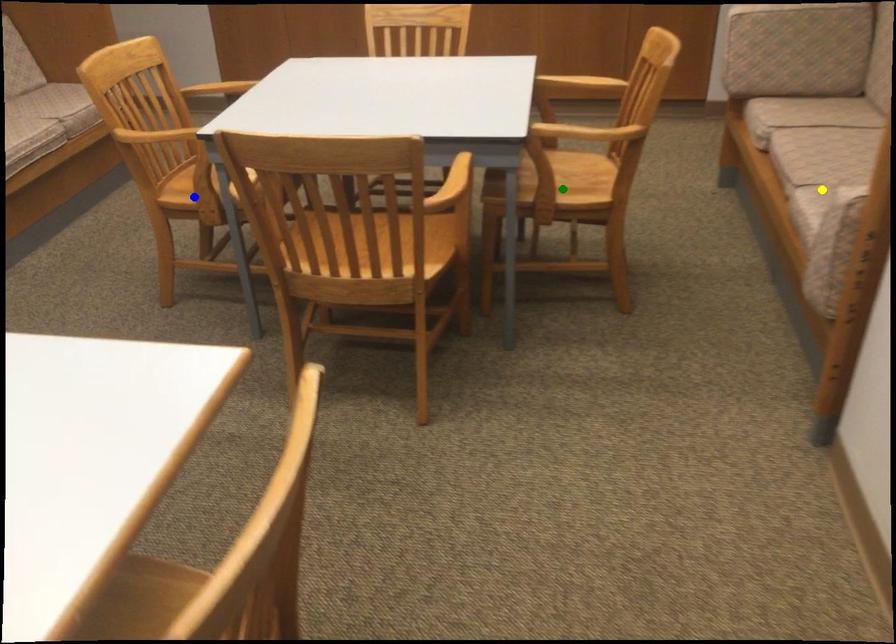
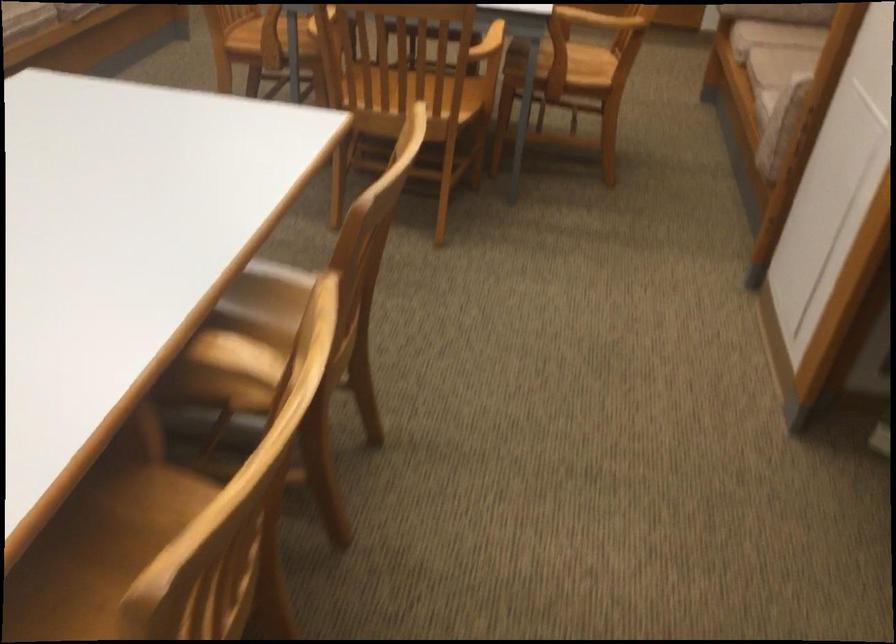
I am providing you with two images of the same scene from different viewpoints. Three points are marked in image1. Which point corresponds to a part or object that is occluded in image2?In image1, three points are marked. Which of them correspond to a part or object that is occluded in image2?Among the three points shown in image1, which one corresponds to a part or object that is no longer visible due to occlusion in image2?

Invisible in image2: yellow point.